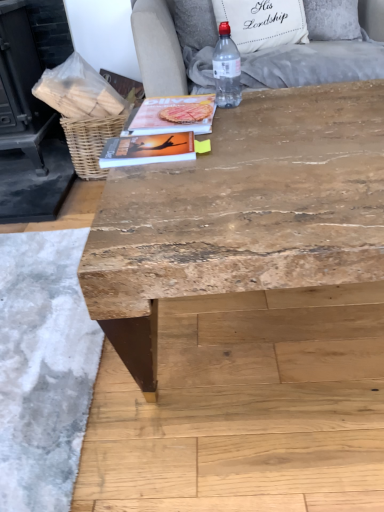
The image size is (384, 512). Find the location of `free spot to the right of clear plastic bottle at upper center`. free spot to the right of clear plastic bottle at upper center is located at coordinates (279, 101).